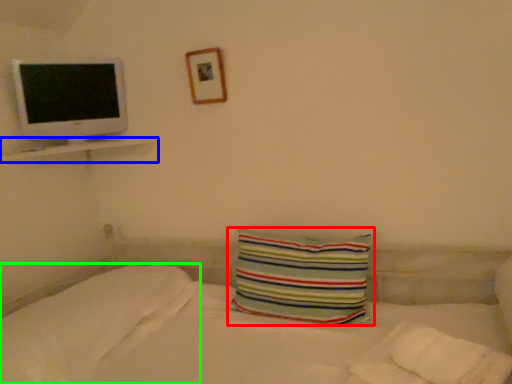
Question: Considering the real-world distances, which object is closest to pillow (highlighted by a red box)? ledge (highlighted by a blue box) or pillow (highlighted by a green box).

Choices:
 (A) ledge
 (B) pillow

Answer: (B)